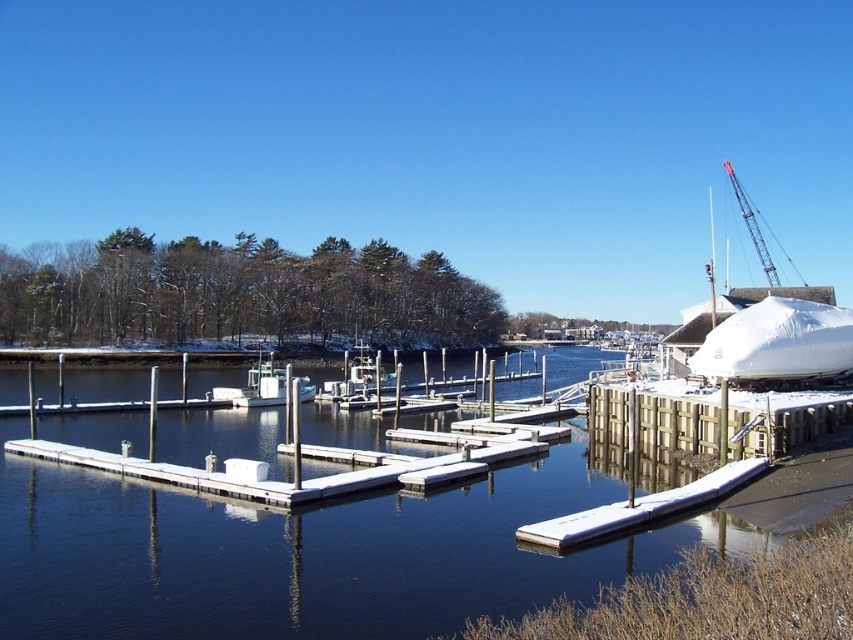
Question: Among these points, which one is farthest from the camera?

Choices:
 (A) (807, 371)
 (B) (556, 538)
 (C) (234, 595)
 (D) (747, 202)

Answer: (D)

Question: Does wooden dock at lower right have a greater width compared to white matte dock at center?

Choices:
 (A) yes
 (B) no

Answer: (A)

Question: Can you confirm if white matte dock at center is smaller than metallic gray crane at upper right?

Choices:
 (A) yes
 (B) no

Answer: (A)

Question: Which object is the closest to the white matte boat at center?

Choices:
 (A) clear water at dock center
 (B) metallic gray crane at upper right
 (C) white tarpaulin boat at right
 (D) wooden dock at lower right

Answer: (A)

Question: Which of the following is the farthest from the observer?

Choices:
 (A) (735, 400)
 (B) (808, 326)
 (C) (645, 513)
 (D) (312, 385)

Answer: (D)

Question: Is clear water at dock center to the right of white matte dock at center from the viewer's perspective?

Choices:
 (A) yes
 (B) no

Answer: (B)